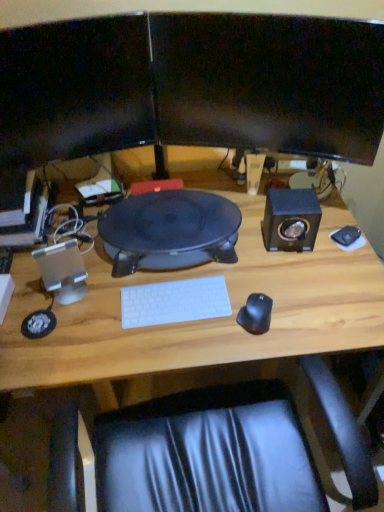
Question: Considering the relative positions of matte black monitor at upper center, which appears as the first computer monitor when viewed from the left, and black rubberized mouse at right, the first mouse in the left-to-right sequence, in the image provided, is matte black monitor at upper center, which appears as the first computer monitor when viewed from the left, to the right of black rubberized mouse at right, the first mouse in the left-to-right sequence, from the viewer's perspective?

Choices:
 (A) no
 (B) yes

Answer: (A)

Question: From a real-world perspective, is matte black monitor at upper center, which appears as the first computer monitor when viewed from the left, on top of black rubberized mouse at right, the 1th mouse when ordered from front to back?

Choices:
 (A) no
 (B) yes

Answer: (B)

Question: From the image's perspective, is matte black monitor at upper center, which appears as the first computer monitor when viewed from the left, above black rubberized mouse at right, the first mouse in the left-to-right sequence?

Choices:
 (A) yes
 (B) no

Answer: (A)

Question: From the image's perspective, is matte black monitor at upper center, the second computer monitor positioned from the right, beneath black rubberized mouse at right, the second mouse viewed from the back?

Choices:
 (A) yes
 (B) no

Answer: (B)

Question: Can you confirm if matte black monitor at upper center, which appears as the first computer monitor when viewed from the left, is bigger than black rubberized mouse at right, the 1th mouse when ordered from front to back?

Choices:
 (A) no
 (B) yes

Answer: (B)

Question: Is the position of matte black monitor at upper center, which appears as the first computer monitor when viewed from the left, less distant than that of black rubberized mouse at right, the second mouse viewed from the back?

Choices:
 (A) no
 (B) yes

Answer: (B)

Question: Is silver metallic speaker at left, arranged as the 2th speaker when viewed from the top, in contact with wooden desk at center?

Choices:
 (A) no
 (B) yes

Answer: (A)

Question: Does silver metallic speaker at left, which is the 2th speaker from right to left, come in front of wooden desk at center?

Choices:
 (A) yes
 (B) no

Answer: (B)

Question: Can you confirm if silver metallic speaker at left, arranged as the 2th speaker when viewed from the top, is shorter than wooden desk at center?

Choices:
 (A) no
 (B) yes

Answer: (B)

Question: Is silver metallic speaker at left, which ranks as the 1th speaker in left-to-right order, turned away from wooden desk at center?

Choices:
 (A) yes
 (B) no

Answer: (B)

Question: Is silver metallic speaker at left, which is the 2th speaker from right to left, oriented towards wooden desk at center?

Choices:
 (A) yes
 (B) no

Answer: (A)

Question: Considering the relative sizes of silver metallic speaker at left, which appears as the 1th speaker when ordered from the bottom, and wooden desk at center in the image provided, is silver metallic speaker at left, which appears as the 1th speaker when ordered from the bottom, smaller than wooden desk at center?

Choices:
 (A) yes
 (B) no

Answer: (A)

Question: Considering the relative positions of metallic silver computer at left and silver metallic speaker at left, which is the 2th speaker from right to left, in the image provided, is metallic silver computer at left to the left of silver metallic speaker at left, which is the 2th speaker from right to left, from the viewer's perspective?

Choices:
 (A) no
 (B) yes

Answer: (B)